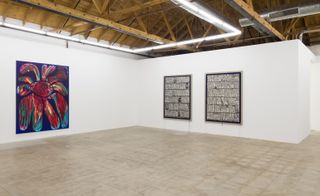
Locate an element on the screen. The height and width of the screenshot is (196, 320). light on the ceilings is located at coordinates (197, 11), (174, 44).